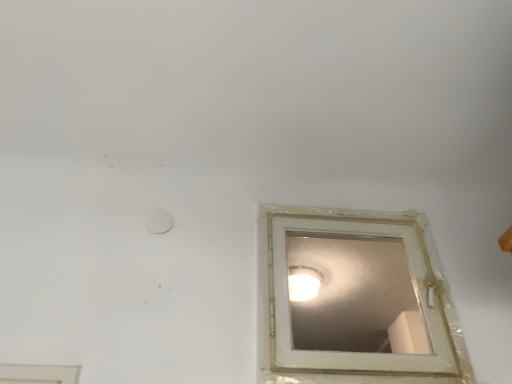
Question: Relative to white glossy light fixture at upper center, is white plastic window at center in front or behind?

Choices:
 (A) front
 (B) behind

Answer: (A)

Question: Which is correct: white plastic window at center is inside white glossy light fixture at upper center, or outside of it?

Choices:
 (A) outside
 (B) inside

Answer: (A)

Question: From a real-world perspective, relative to white glossy light fixture at upper center, is white plastic window at center vertically above or below?

Choices:
 (A) above
 (B) below

Answer: (B)

Question: From the image's perspective, is white glossy light fixture at upper center above or below white plastic window at center?

Choices:
 (A) above
 (B) below

Answer: (B)

Question: Is white glossy light fixture at upper center in front of or behind white plastic window at center in the image?

Choices:
 (A) front
 (B) behind

Answer: (B)

Question: Is white glossy light fixture at upper center spatially inside white plastic window at center, or outside of it?

Choices:
 (A) outside
 (B) inside

Answer: (A)

Question: Considering the positions of white glossy light fixture at upper center and white plastic window at center in the image, is white glossy light fixture at upper center wider or thinner than white plastic window at center?

Choices:
 (A) thin
 (B) wide

Answer: (B)